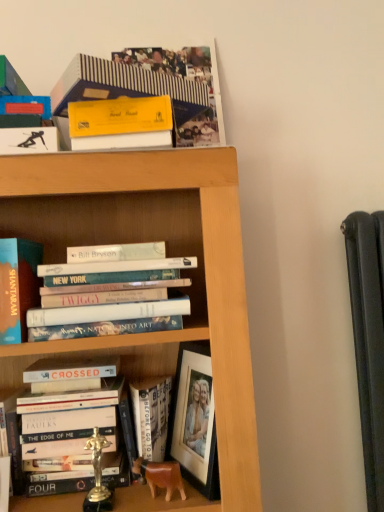
Question: Considering the relative positions of matte blue book at left, placed as the 3th book when sorted from top to bottom, and striped paper book at upper center, acting as the first book starting from the top, in the image provided, is matte blue book at left, placed as the 3th book when sorted from top to bottom, to the left or to the right of striped paper book at upper center, acting as the first book starting from the top,?

Choices:
 (A) left
 (B) right

Answer: (A)

Question: Considering their positions, is matte blue book at left, placed as the 3th book when sorted from top to bottom, located in front of or behind striped paper book at upper center, which is the 5th book from bottom to top?

Choices:
 (A) behind
 (B) front

Answer: (A)

Question: Considering the real-world distances, which object is closest to the hardcover book at center, which ranks as the first book in bottom-to-top order?

Choices:
 (A) matte blue book at left, placed as the 3th book when sorted from top to bottom
 (B) hardcover book at lower left, which appears as the 4th book when viewed from the top
 (C) striped paper book at upper center, which is the 5th book from bottom to top
 (D) hardcover books at center, placed as the 2th book when sorted from top to bottom

Answer: (B)

Question: Estimate the real-world distances between objects in this image. Which object is closer to the hardcover book at lower left, marked as the 2th book in a bottom-to-top arrangement?

Choices:
 (A) hardcover books at center, placed as the 2th book when sorted from top to bottom
 (B) hardcover book at center, which ranks as the first book in bottom-to-top order
 (C) matte blue book at left, the third book positioned from the bottom
 (D) striped paper book at upper center, which is the 5th book from bottom to top

Answer: (B)